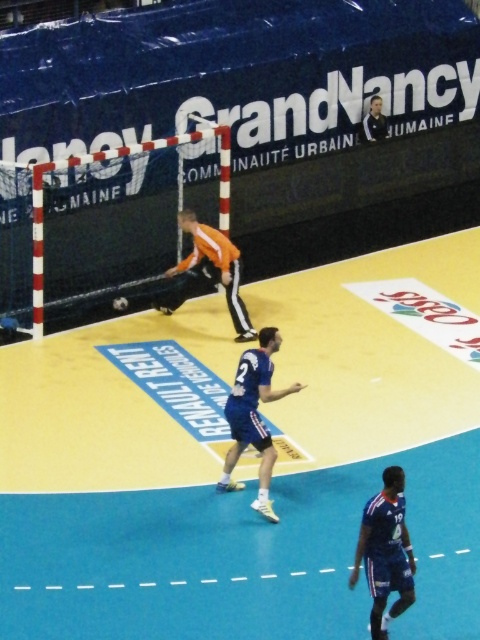
You are a referee in a handball match. You need to determine if the player in the blue fabric jersey at lower right can reach the ball that is at the same height as the blue fabric jersey at center. Can they?

The blue fabric jersey at lower right is not as tall as the blue fabric jersey at center, so the player in the blue fabric jersey at lower right is shorter and may not be able to reach the ball at the height of the blue fabric jersey at center.

You are a referee in a handball match. You need to determine if the ball is within the playing area. The playing area is defined as the area between the two goal lines and the two side lines. The coordinates of the ball are given as point (x=385, y=550). The playing area has a coordinate system where the bottom left corner is 0,0 and the top right corner is 1,1. Is the ball within the playing area?

The ball is at point (x=385, y=550). Since the playing area spans from 0,0 to 1,1, the ball is within the playing area as its coordinates are within these bounds.

You are a referee observing the handball match. You notice two players wearing blue fabric jersey at lower right and blue fabric jersey at center. Which player is taking up more space in the current frame?

The blue fabric jersey at center is taking up more space in the current frame compared to the blue fabric jersey at lower right, as it occupies more area.